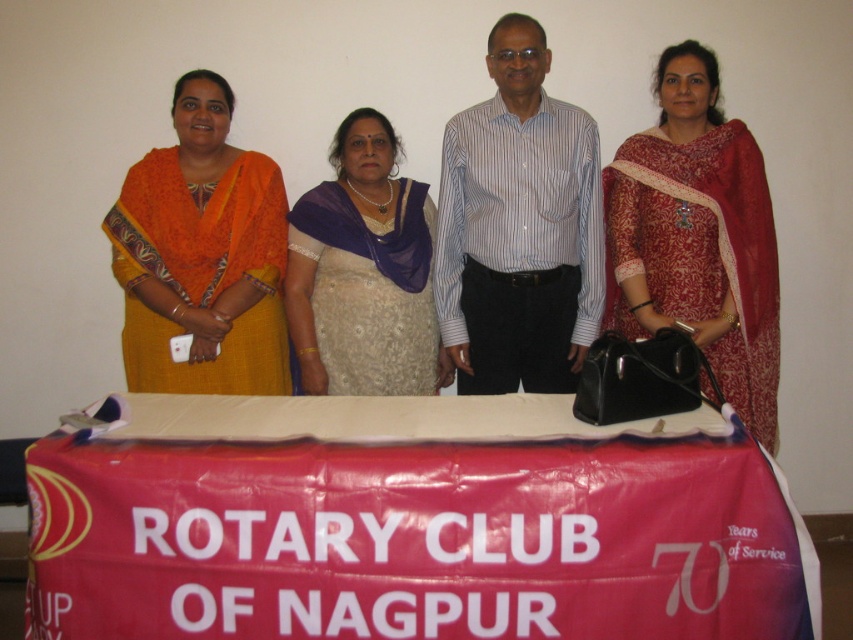
You are a photographer at the event and want to capture a photo where the red fabric banner at center and the matte red saree at right are both clearly visible. Based on their positions, which object should be placed closer to the left side of the photo frame?

The red fabric banner at center is positioned on the left side of matte red saree at right, so to have both visible, the banner should be placed closer to the left side of the photo frame.

You are a photographer at the event and want to ensure there is enough space between the blue striped shirt at center and the beige embroidered saree at center for a group photo. The minimum required distance between any two people in the photo is 10 inches. Can you confirm if the current distance meets the requirement?

The blue striped shirt at center is 10.25 inches away from the beige embroidered saree at center, which exceeds the minimum required distance of 10 inches. Therefore, the current spacing is sufficient for the group photo.

You are a photographer standing in front of the red fabric banner at center. You want to take a photo of the banner without any people in the frame. Considering the distance between you and the banner, is it possible to step back enough to ensure that the four individuals behind the table are not visible in the photo?

The distance between you and the red fabric banner at center is 1.61 meters. To avoid capturing the individuals behind the table in the photo, you would need to step back sufficiently so that the banner fills the frame while the people are out of view. However, since the banner is already at a relatively close distance, stepping back might require a significant adjustment depending on the camera lens used. A wide angle lens might still include the people in the background even at that distance, so using a 5